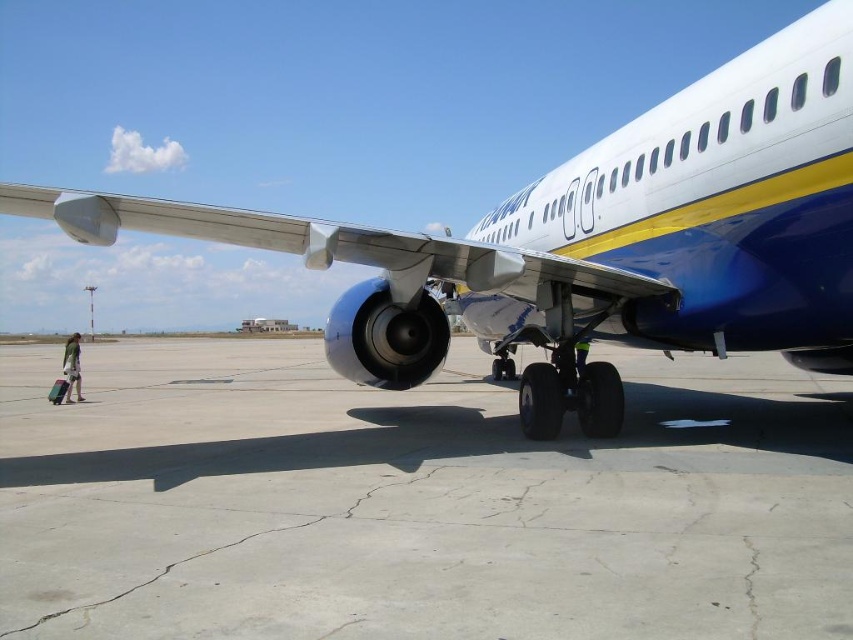
You are a drone operator trying to land a drone on the gray concrete tarmac at center. What are the coordinates where you should aim the drone?

The gray concrete tarmac at center is located at coordinates point [416,502], so you should aim the drone at point [416,502].

You are a photographer standing on the airport tarmac and want to take a picture of the white glossy airplane at center. However, you notice the gray concrete tarmac at center is blocking your view. Can you move closer to the airplane to get a clear shot without the tarmac in the way?

The gray concrete tarmac at center is closer to the viewer than the white glossy airplane at center, so moving closer to the airplane might not help because the tarmac is already in front of it. You might need to adjust your position sideways or angle your camera to avoid the obstruction.